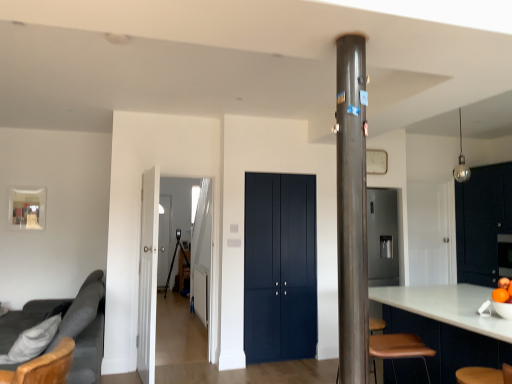
Question: Is matte dark blue cabinet at center, which is counted as the second door, starting from the front, thinner than transparent glass door at center, which is the 2th glass door in front-to-back order?

Choices:
 (A) yes
 (B) no

Answer: (A)

Question: From the image's perspective, is matte dark blue cabinet at center, the first door when ordered from back to front, located above transparent glass door at center, which ranks as the first glass door in left-to-right order?

Choices:
 (A) no
 (B) yes

Answer: (B)

Question: Considering the relative positions of matte dark blue cabinet at center, the first door when ordered from back to front, and transparent glass door at center, which is the 2th glass door in front-to-back order, in the image provided, is matte dark blue cabinet at center, the first door when ordered from back to front, to the right of transparent glass door at center, which is the 2th glass door in front-to-back order, from the viewer's perspective?

Choices:
 (A) no
 (B) yes

Answer: (B)

Question: Is matte dark blue cabinet at center, which is the 2th door from left to right, smaller than transparent glass door at center, which is the 2th glass door in front-to-back order?

Choices:
 (A) yes
 (B) no

Answer: (B)

Question: Can you confirm if matte dark blue cabinet at center, the first door when ordered from right to left, is shorter than transparent glass door at center, which ranks as the 2th glass door in right-to-left order?

Choices:
 (A) no
 (B) yes

Answer: (B)

Question: From the image's perspective, does matte dark blue cabinet at center, which is counted as the second door, starting from the front, appear lower than transparent glass door at center, which ranks as the 2th glass door in right-to-left order?

Choices:
 (A) no
 (B) yes

Answer: (A)

Question: Is transparent glass door at center, which ranks as the 2th glass door in right-to-left order, touching matte dark blue cabinet at center, the first door when ordered from right to left?

Choices:
 (A) yes
 (B) no

Answer: (B)

Question: Is transparent glass door at center, which ranks as the first glass door in left-to-right order, bigger than matte dark blue cabinet at center, the first door when ordered from right to left?

Choices:
 (A) yes
 (B) no

Answer: (B)

Question: Does transparent glass door at center, which ranks as the first glass door in left-to-right order, lie behind matte dark blue cabinet at center, which is counted as the second door, starting from the front?

Choices:
 (A) yes
 (B) no

Answer: (A)

Question: Is transparent glass door at center, which ranks as the 2th glass door in right-to-left order, thinner than matte dark blue cabinet at center, the first door when ordered from right to left?

Choices:
 (A) no
 (B) yes

Answer: (A)

Question: Is transparent glass door at center, the first glass door viewed from the back, to the left of matte dark blue cabinet at center, which is counted as the second door, starting from the front, from the viewer's perspective?

Choices:
 (A) yes
 (B) no

Answer: (A)

Question: Considering the relative positions of transparent glass door at center, which ranks as the first glass door in left-to-right order, and matte dark blue cabinet at center, the first door when ordered from right to left, in the image provided, is transparent glass door at center, which ranks as the first glass door in left-to-right order, in front of matte dark blue cabinet at center, the first door when ordered from right to left,?

Choices:
 (A) no
 (B) yes

Answer: (A)

Question: Considering the relative sizes of matte dark blue cabinet at center, which is counted as the second door, starting from the front, and shiny black dresser at right in the image provided, is matte dark blue cabinet at center, which is counted as the second door, starting from the front, bigger than shiny black dresser at right?

Choices:
 (A) yes
 (B) no

Answer: (B)